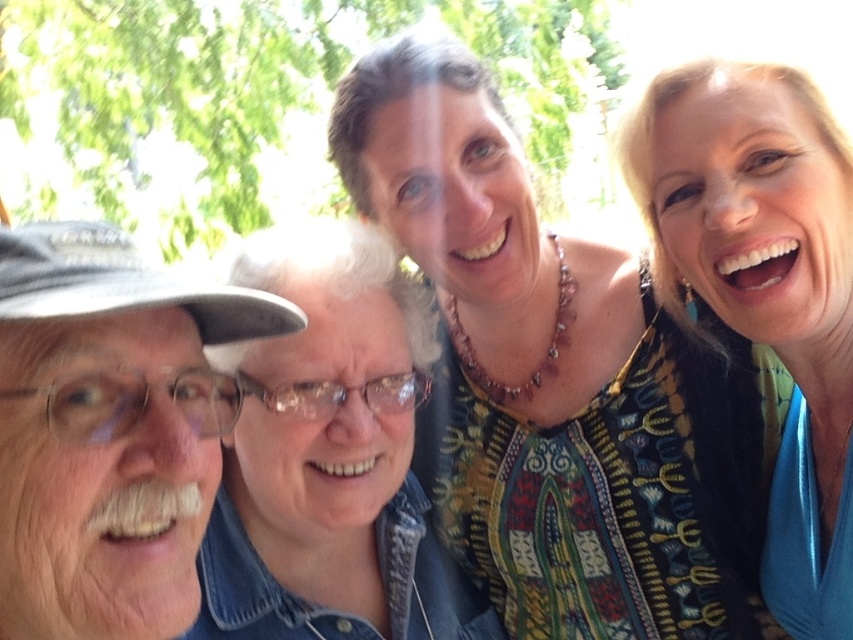
In the scene, there are two people posing for a selfie. The multicolored fabric top at center and the white matte cap at left are visible. Which object is positioned higher in the image?

The multicolored fabric top at center is positioned higher than the white matte cap at left in the image.

You are a photographer trying to capture a group photo of the scene. You want to ensure that the white matte cap at left and the blonde hair at upper right are both in focus. Given that your camera has a depth of field that can cover 30 inches, will both subjects be in focus?

The white matte cap at left is 29.33 inches from blonde hair at upper right. Since the distance between them is within the camera depth of field of 30 inches, both subjects will be in focus.

You are a photographer trying to capture a closeup of the multicolored fabric top at center and the white matte cap at left. Which object should you zoom in on first to ensure it fits in the frame before adjusting the camera settings?

The multicolored fabric top at center is bigger than the white matte cap at left, so you should zoom in on the white matte cap at left first to ensure it fits in the frame before adjusting for the larger top.